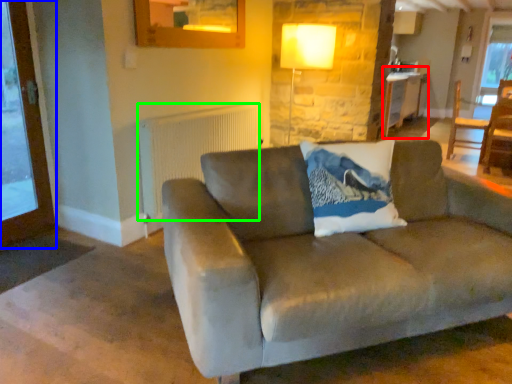
Question: Which is farther away from table (highlighted by a red box)? screen door (highlighted by a blue box) or radiator (highlighted by a green box)?

Choices:
 (A) screen door
 (B) radiator

Answer: (A)